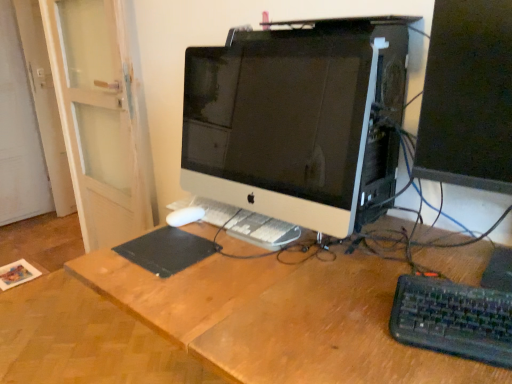
At what (x,y) coordinates should I click in order to perform the action: click on vacant area that is situated to the right of black matte mousepad at center. Please return your answer as a coordinate pair (x, y). Looking at the image, I should click on (243, 261).